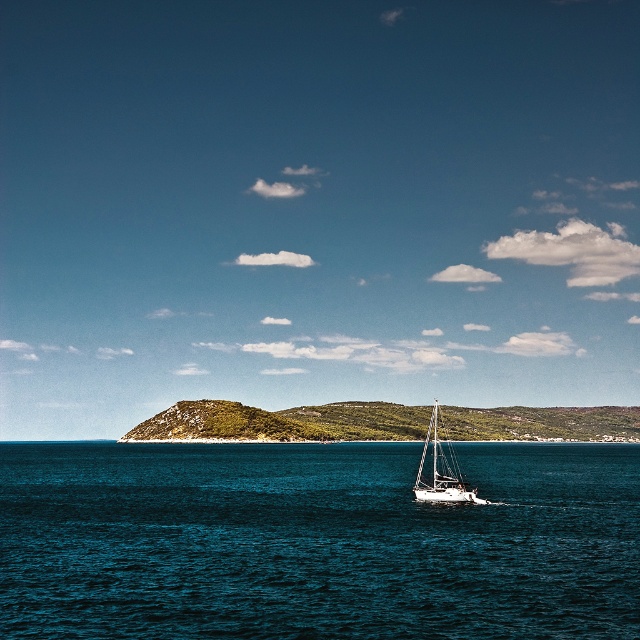
You are standing on a boat and want to reach a specific point in the water marked as point [3,476]. The boat can travel at a speed of 5 meters per minute. How many minutes will it take to reach that point?

The point [3,476] is 140.98 meters away from the camera. At a speed of 5 meters per minute, it would take approximately 28.2 minutes to reach the point.

You are a sailor navigating a small boat and need to know which area is bigger between the deep blue water at center and the green grassy hill at center. Which one should you choose to anchor your boat?

The deep blue water at center has a larger size compared to the green grassy hill at center, so you should choose to anchor your boat in the deep blue water at center as it offers more space.